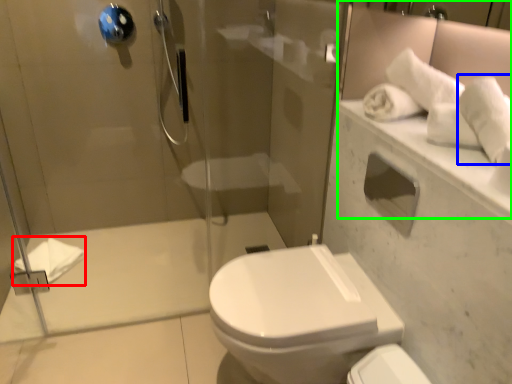
Question: Which is nearer to the bath towel (highlighted by a red box)? bath towel (highlighted by a blue box) or mirror (highlighted by a green box).

Choices:
 (A) bath towel
 (B) mirror

Answer: (B)